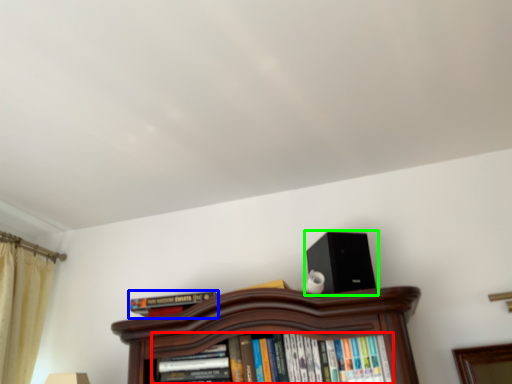
Question: Estimate the real-world distances between objects in this image. Which object is farther from book (highlighted by a red box), book (highlighted by a blue box) or loudspeaker (highlighted by a green box)?

Choices:
 (A) book
 (B) loudspeaker

Answer: (A)